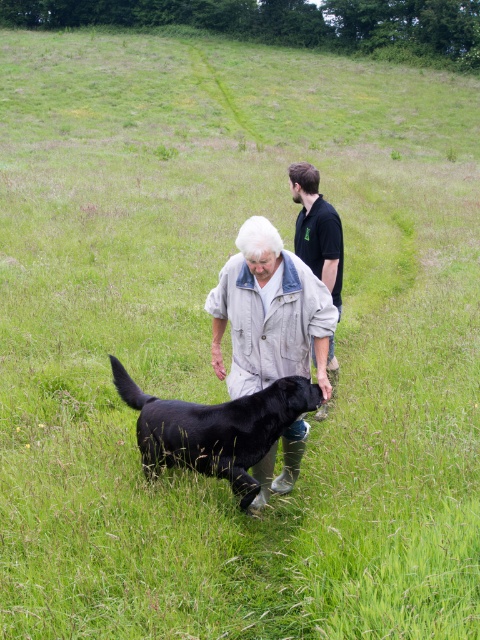
Question: Based on their relative distances, which object is nearer to the black shirt at center?

Choices:
 (A) shiny black dog at center
 (B) light beige denim jacket at center

Answer: (B)

Question: Which point is closer to the camera taking this photo?

Choices:
 (A) (272, 436)
 (B) (327, 372)
 (C) (312, 305)

Answer: (C)

Question: Does light beige denim jacket at center have a greater width compared to shiny black dog at center?

Choices:
 (A) no
 (B) yes

Answer: (A)

Question: Is shiny black dog at center to the left of black shirt at center from the viewer's perspective?

Choices:
 (A) yes
 (B) no

Answer: (A)

Question: Is light beige denim jacket at center to the right of black shirt at center from the viewer's perspective?

Choices:
 (A) yes
 (B) no

Answer: (B)

Question: Which point appears closest to the camera in this image?

Choices:
 (A) (284, 324)
 (B) (259, 401)
 (C) (296, 166)

Answer: (A)